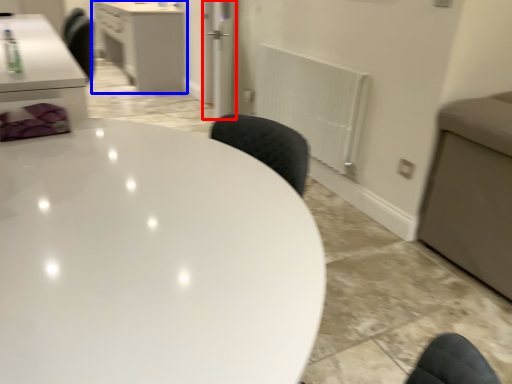
Question: Among these objects, which one is farthest to the camera, glass door (highlighted by a red box) or cabinetry (highlighted by a blue box)?

Choices:
 (A) glass door
 (B) cabinetry

Answer: (B)